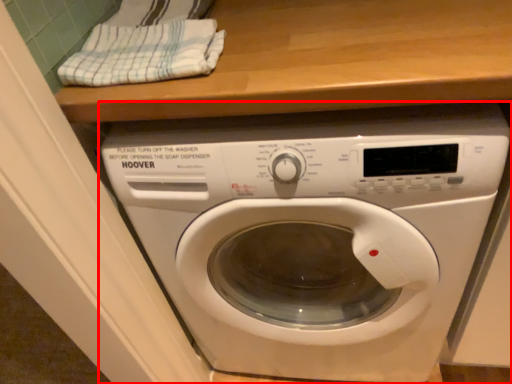
Question: Observing the image, what is the correct spatial positioning of washing machine (annotated by the red box) in reference to clothe?

Choices:
 (A) left
 (B) right

Answer: (B)